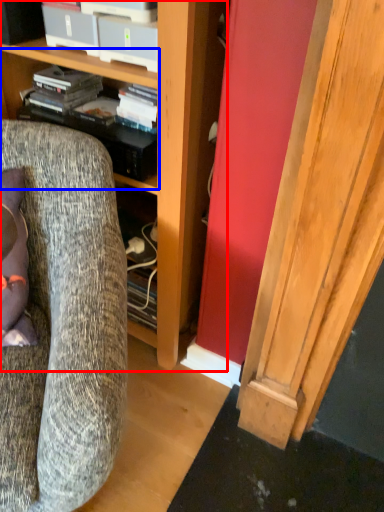
Question: Among these objects, which one is nearest to the camera, cabinetry (highlighted by a red box) or shelf (highlighted by a blue box)?

Choices:
 (A) cabinetry
 (B) shelf

Answer: (A)